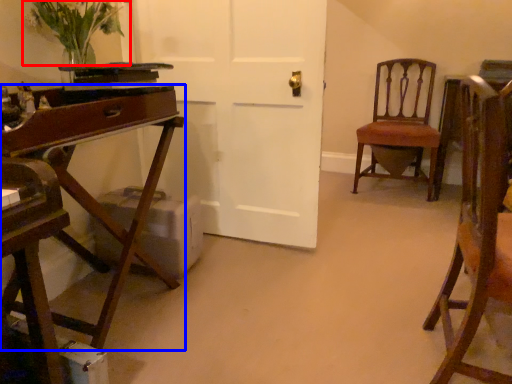
Question: Which of the following is the closest to the observer, floral arrangement (highlighted by a red box) or desk (highlighted by a blue box)?

Choices:
 (A) floral arrangement
 (B) desk

Answer: (B)